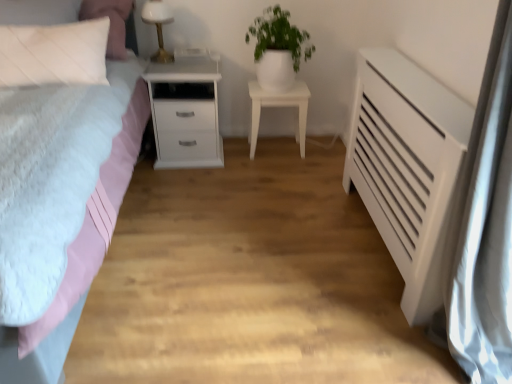
Find the location of a particular element. The width and height of the screenshot is (512, 384). free space between white matte radiator at right and white glossy nightstand at center, acting as the second nightstand starting from the left is located at coordinates (325, 213).